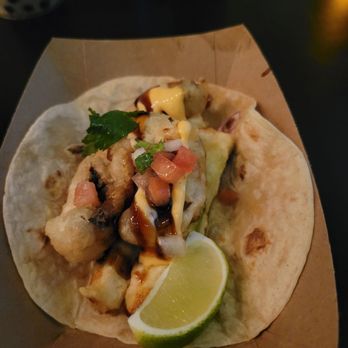
Find the location of a particular element. Image resolution: width=348 pixels, height=348 pixels. cup is located at coordinates (19, 7).